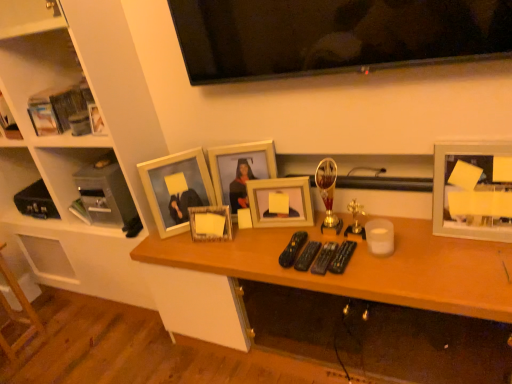
Locate an element on the screen. vacant space in front of matte wooden picture frame at center, which appears as the 5th picture frame when viewed from the right is located at coordinates (190, 244).